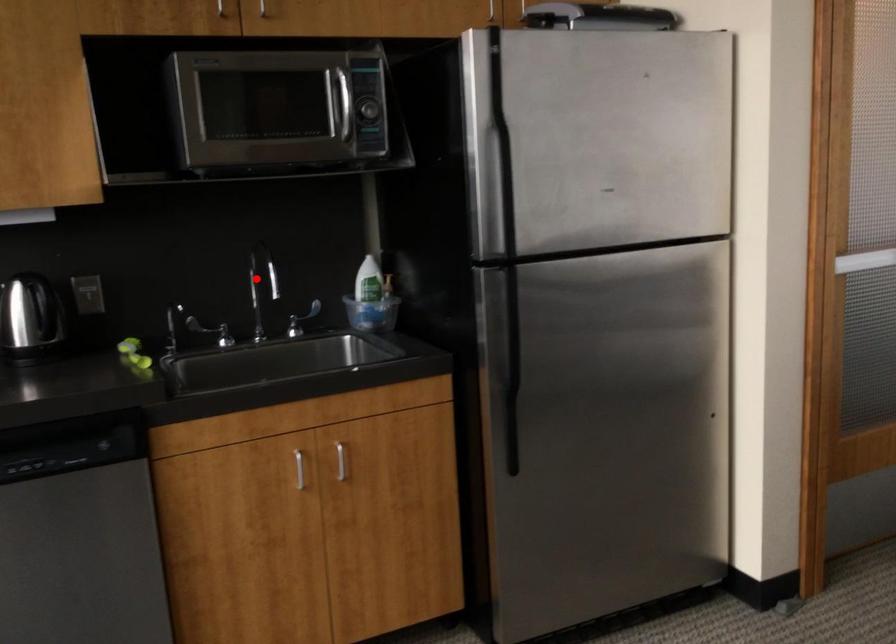
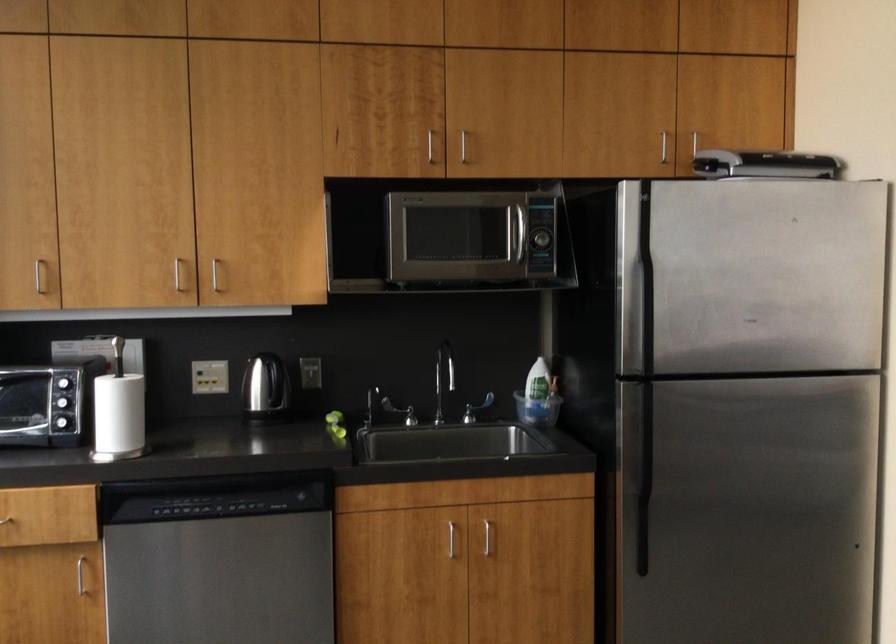
Where in the second image is the point corresponding to the highlighted location from the first image?

(444, 371)